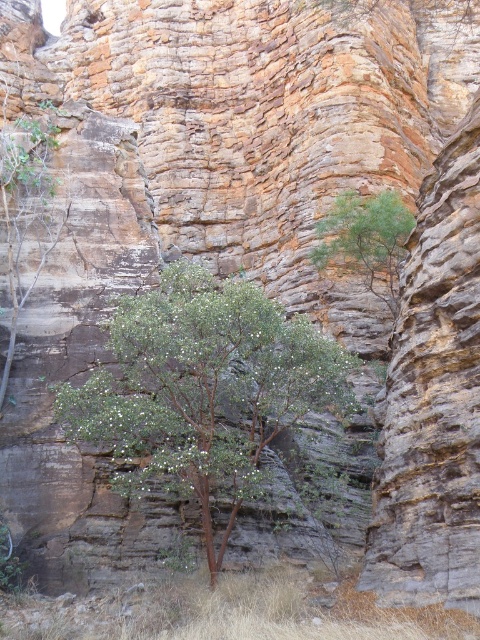
You are a hiker standing at the base of the cliff and see the green leafy tree at center and the green leafy tree at upper center. Which tree is taller?

The green leafy tree at center is much taller than the green leafy tree at upper center.

You are a hiker planning to set up a campsite in this rocky area. You need to choose between the green leafy tree at center and the green leafy shrub at left for shade. Which one would provide more shade coverage?

The green leafy tree at center has a larger size compared to the green leafy shrub at left, so it would provide more shade coverage.

You are a botanist studying plants in this rocky landscape. You notice the green leafy tree at center and the green leafy shrub at left. Which plant is taller?

The green leafy shrub at left is taller than the green leafy tree at center.